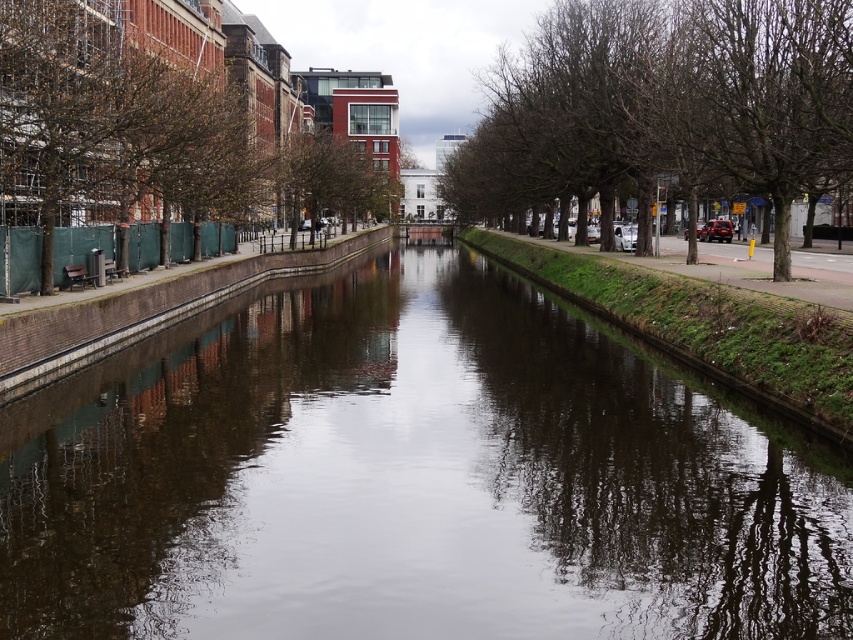
Question: Which point appears closest to the camera in this image?

Choices:
 (A) (688, 13)
 (B) (164, 240)

Answer: (B)

Question: Is dark reflective water at center smaller than brown leafy tree at left?

Choices:
 (A) no
 (B) yes

Answer: (B)

Question: Estimate the real-world distances between objects in this image. Which object is farther from the brown leafy tree at left?

Choices:
 (A) dark reflective water at center
 (B) bare branches at right

Answer: (A)

Question: Which point appears farthest from the camera in this image?

Choices:
 (A) (100, 486)
 (B) (154, 32)

Answer: (B)

Question: Does dark reflective water at center have a lesser width compared to brown leafy tree at left?

Choices:
 (A) yes
 (B) no

Answer: (A)

Question: Is brown leafy tree at left above bare branches at right?

Choices:
 (A) no
 (B) yes

Answer: (B)